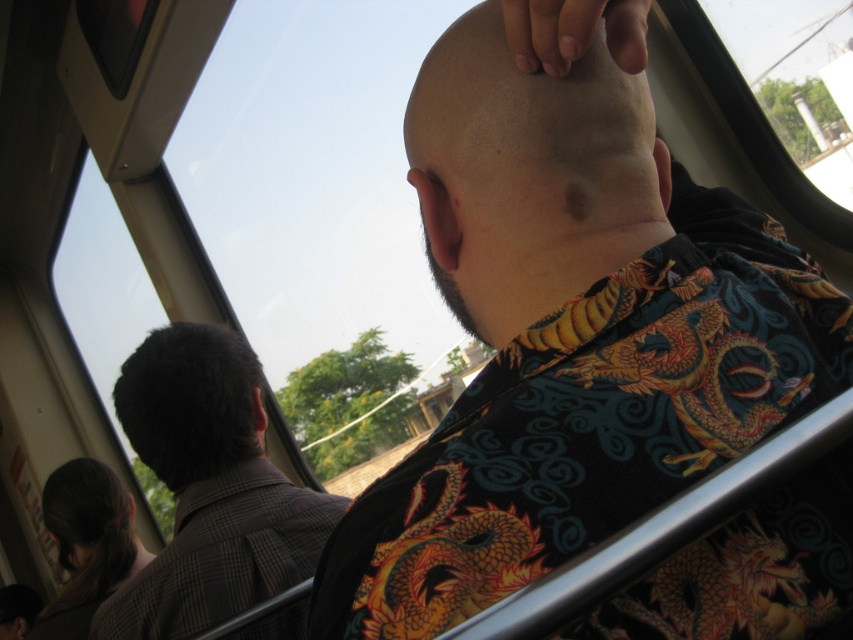
Which is below, brown checkered coat at left or brown hair at lower left?

Positioned lower is brown hair at lower left.

Is the position of brown checkered coat at left less distant than that of brown hair at lower left?

Yes, brown checkered coat at left is closer to the viewer.

Which is behind, point (152, 440) or point (61, 492)?

Positioned behind is point (61, 492).

Identify the location of brown checkered coat at left. This screenshot has height=640, width=853. (209, 486).

Is smooth bald head at upper center smaller than brown checkered coat at left?

Indeed, smooth bald head at upper center has a smaller size compared to brown checkered coat at left.

What are the coordinates of `smooth bald head at upper center` in the screenshot? It's located at (534, 156).

Is point (490, 157) farther from viewer compared to point (90, 568)?

That is False.

Is smooth bald head at upper center taller than brown hair at lower left?

No.

You are a GUI agent. You are given a task and a screenshot of the screen. Output one action in this format:
    pyautogui.click(x=<x>, y=<y>)
    Task: Click on the smooth bald head at upper center
    The height and width of the screenshot is (640, 853).
    Given the screenshot: What is the action you would take?
    pyautogui.click(x=534, y=156)